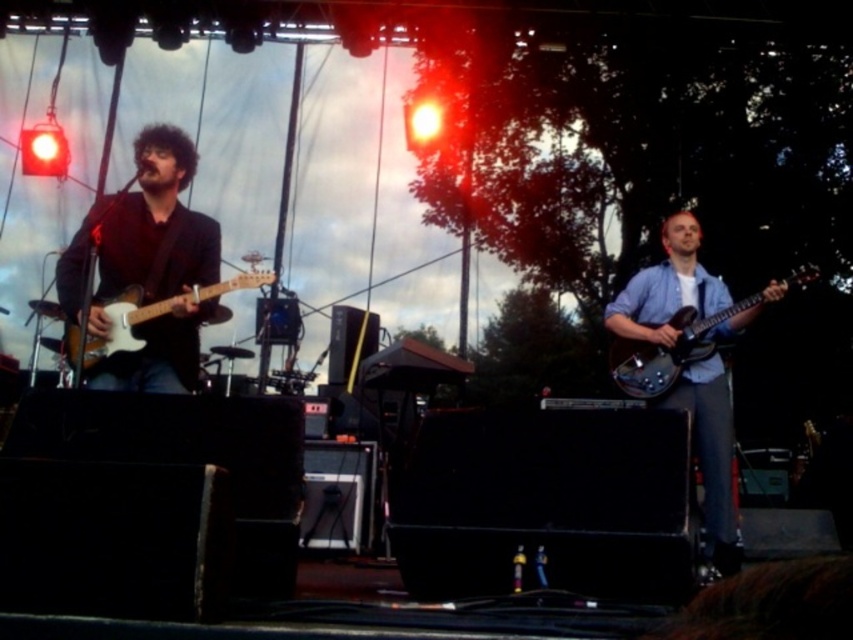
Is glossy black guitar at right to the left of matte wood electric guitar at left from the viewer's perspective?

No, glossy black guitar at right is not to the left of matte wood electric guitar at left.

Is glossy black guitar at right bigger than matte wood electric guitar at left?

Incorrect, glossy black guitar at right is not larger than matte wood electric guitar at left.

In order to click on glossy black guitar at right in this screenshot , I will do `click(668, 349)`.

Measure the distance between point (689, 404) and camera.

Point (689, 404) is 13.24 feet from camera.

Does blue denim shirt at right appear under glossy black guitar at right?

Indeed, blue denim shirt at right is positioned under glossy black guitar at right.

Which is in front, point (717, 520) or point (643, 365)?

Point (717, 520) is in front.

Find the location of `blue denim shirt at right`. blue denim shirt at right is located at coordinates (666, 288).

In the scene shown: Does matte black guitar at left have a lesser height compared to matte wood electric guitar at left?

No, matte black guitar at left is not shorter than matte wood electric guitar at left.

Is point (142, 236) farther from viewer compared to point (148, 316)?

Yes, it is.

What do you see at coordinates (148, 266) in the screenshot?
I see `matte black guitar at left` at bounding box center [148, 266].

Identify the location of matte black guitar at left. (148, 266).